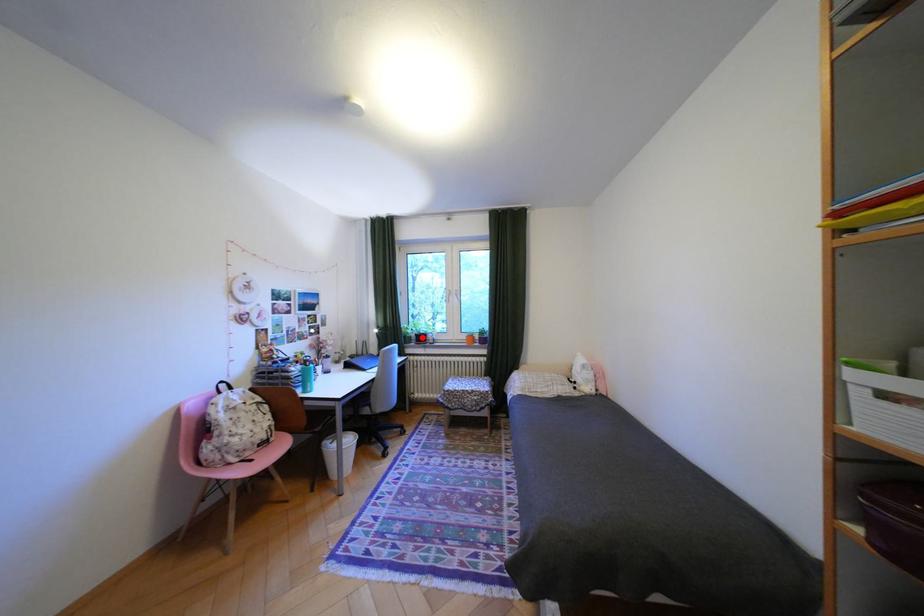
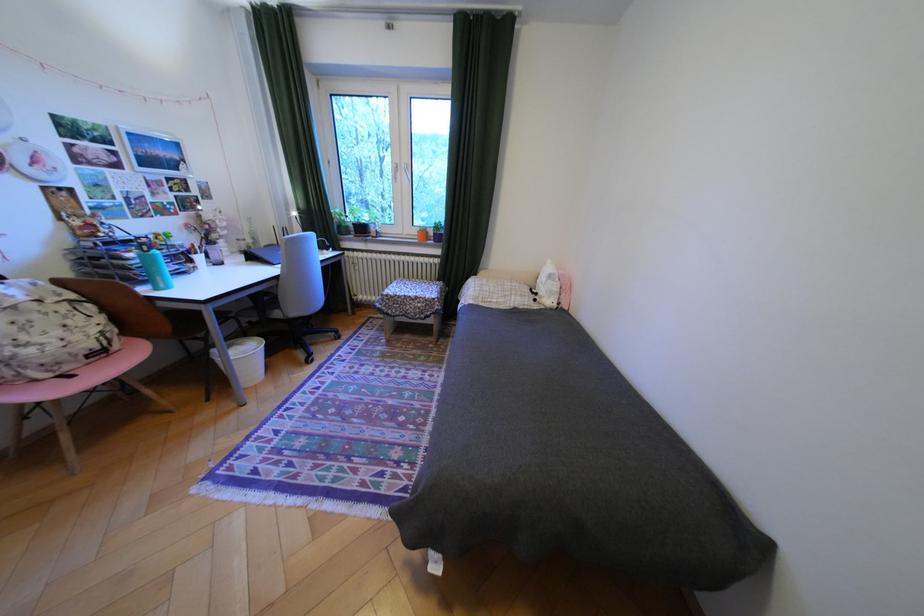
Question: I am providing you with two images of the same scene from different viewpoints. Given a red point in image1, look at the same physical point in image2. Is it:

Choices:
 (A) Closer to the viewpoint
 (B) Farther from the viewpoint

Answer: (A)